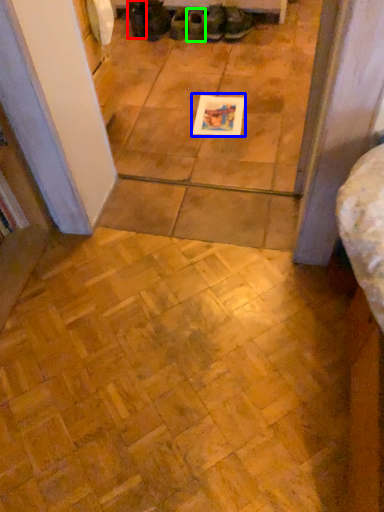
Question: Considering the real-world distances, which object is closest to footwear (highlighted by a red box)? postcard (highlighted by a blue box) or footwear (highlighted by a green box).

Choices:
 (A) postcard
 (B) footwear

Answer: (B)